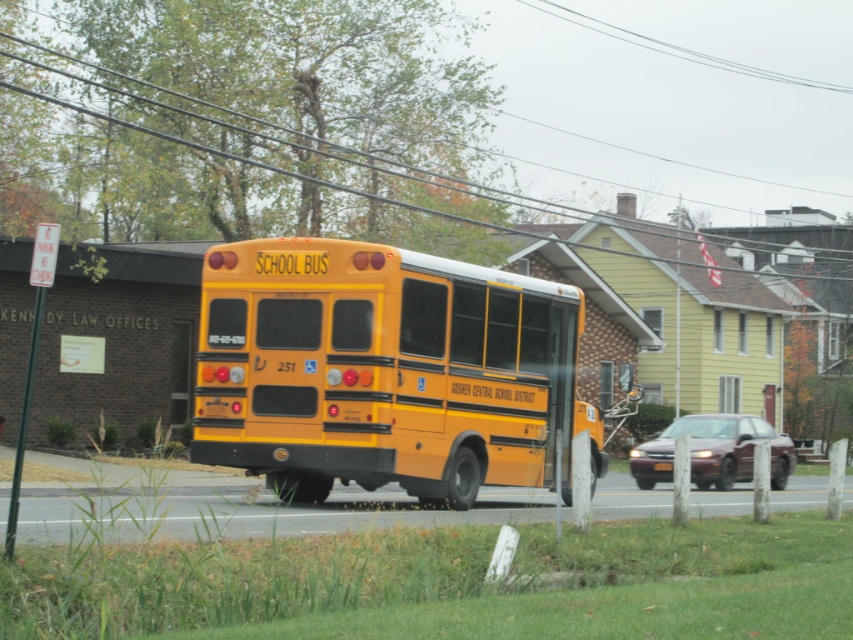
Question: Estimate the real-world distances between objects in this image. Which object is farther from the yellow matte school bus at center?

Choices:
 (A) black wire at upper center
 (B) maroon glossy sedan at center

Answer: (A)

Question: Is black wire at upper center thinner than maroon glossy sedan at center?

Choices:
 (A) yes
 (B) no

Answer: (B)

Question: Is the position of black wire at upper center less distant than that of maroon glossy sedan at center?

Choices:
 (A) no
 (B) yes

Answer: (B)

Question: Is yellow matte school bus at center to the left of maroon glossy sedan at center from the viewer's perspective?

Choices:
 (A) no
 (B) yes

Answer: (B)

Question: Which object appears farthest from the camera in this image?

Choices:
 (A) maroon glossy sedan at center
 (B) black wire at upper center
 (C) yellow matte school bus at center

Answer: (A)

Question: Which object is closer to the camera taking this photo?

Choices:
 (A) yellow matte school bus at center
 (B) black wire at upper center
 (C) maroon glossy sedan at center

Answer: (B)